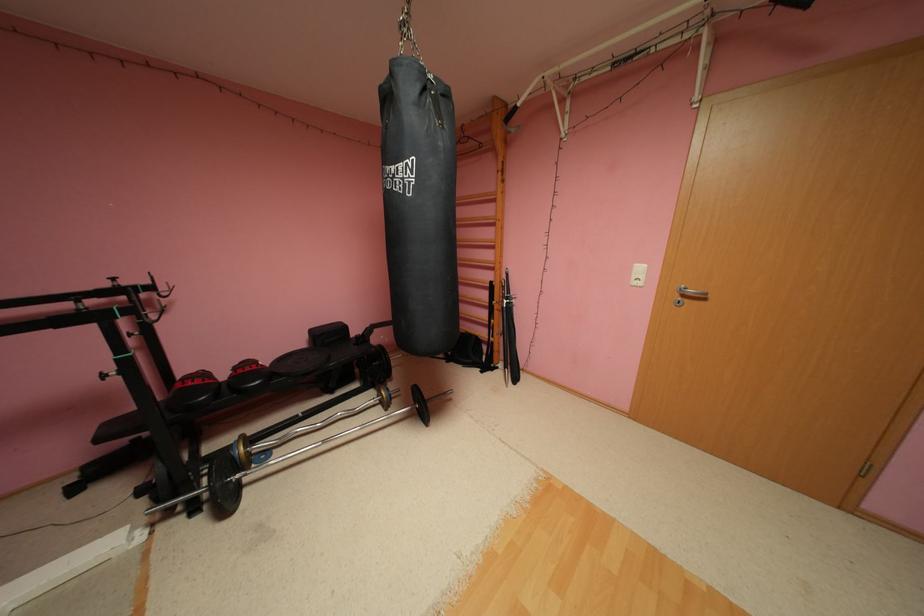
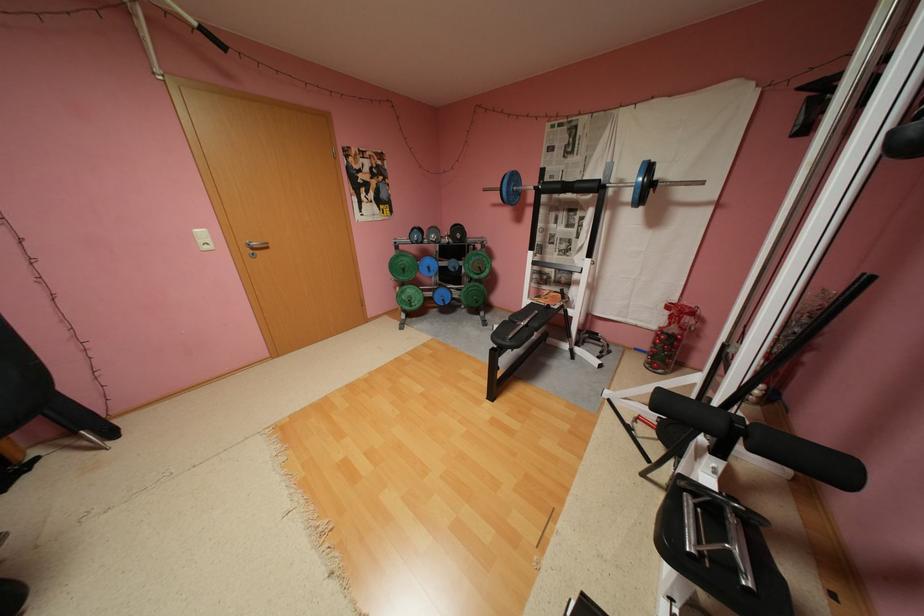
The point at (642, 276) is marked in the first image. Where is the corresponding point in the second image?

(210, 241)